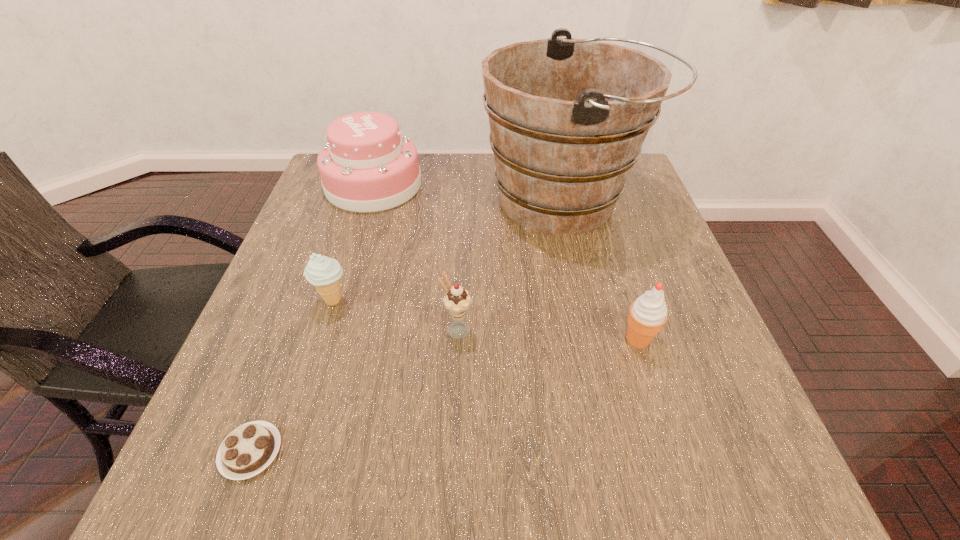
The height and width of the screenshot is (540, 960). What are the coordinates of `the tallest object` in the screenshot? It's located at (568, 117).

Image resolution: width=960 pixels, height=540 pixels. I want to click on cake, so click(367, 165).

Where is `the rightmost icecream`? This screenshot has height=540, width=960. the rightmost icecream is located at coordinates (648, 313).

At what (x,y) coordinates should I click in order to perform the action: click on the second icecream from right to left. Please return your answer as a coordinate pair (x, y). The height and width of the screenshot is (540, 960). Looking at the image, I should click on (457, 301).

Locate an element on the screen. the leftmost icecream is located at coordinates (323, 272).

Locate an element on the screen. The width and height of the screenshot is (960, 540). the farthest icecream is located at coordinates (323, 272).

In order to click on chocolate cake in this screenshot , I will do `click(250, 448)`.

The width and height of the screenshot is (960, 540). Find the location of `the shortest object`. the shortest object is located at coordinates (250, 448).

Identify the location of vacant space located on the front of the cake. [x=338, y=302].

The image size is (960, 540). In order to click on free spot located 0.350m on the left of the rightmost icecream in this screenshot , I will do `click(437, 340)`.